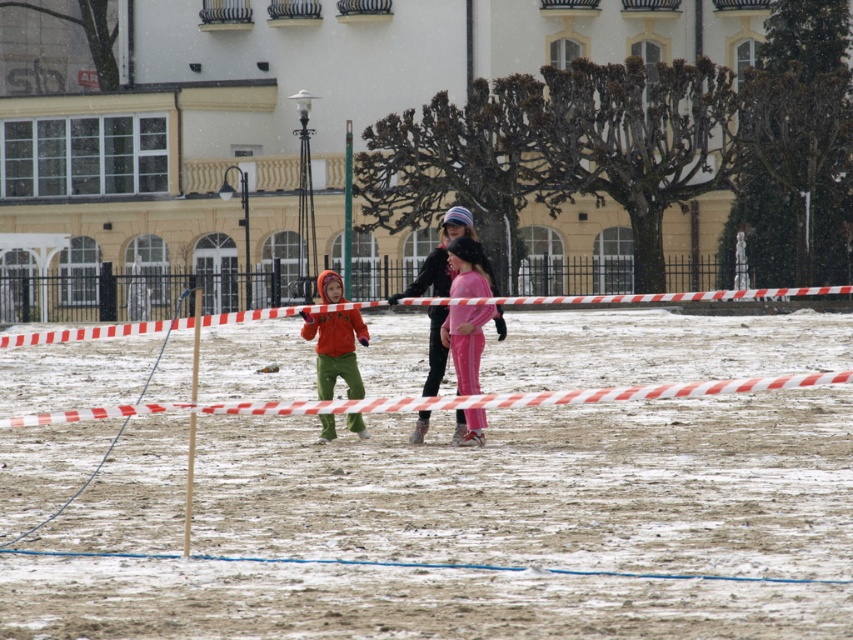
Question: Among these points, which one is nearest to the camera?

Choices:
 (A) (345, 200)
 (B) (193, 422)
 (C) (350, 321)

Answer: (B)

Question: Which of the following is the farthest from the observer?

Choices:
 (A) pink fleece pants at center
 (B) metallic pole at center

Answer: (B)

Question: From the image, what is the correct spatial relationship of pink fleece pants at center in relation to metallic pole at center?

Choices:
 (A) right
 (B) left

Answer: (A)

Question: Considering the relative positions of pink fabric pants at center and metallic pole at center in the image provided, where is pink fabric pants at center located with respect to metallic pole at center?

Choices:
 (A) above
 (B) below

Answer: (B)

Question: Which object appears closest to the camera in this image?

Choices:
 (A) wooden pole at center
 (B) white plastic tape at center
 (C) pink fabric pants at center

Answer: (B)

Question: Is pink fabric pants at center below metallic pole at center?

Choices:
 (A) no
 (B) yes

Answer: (B)